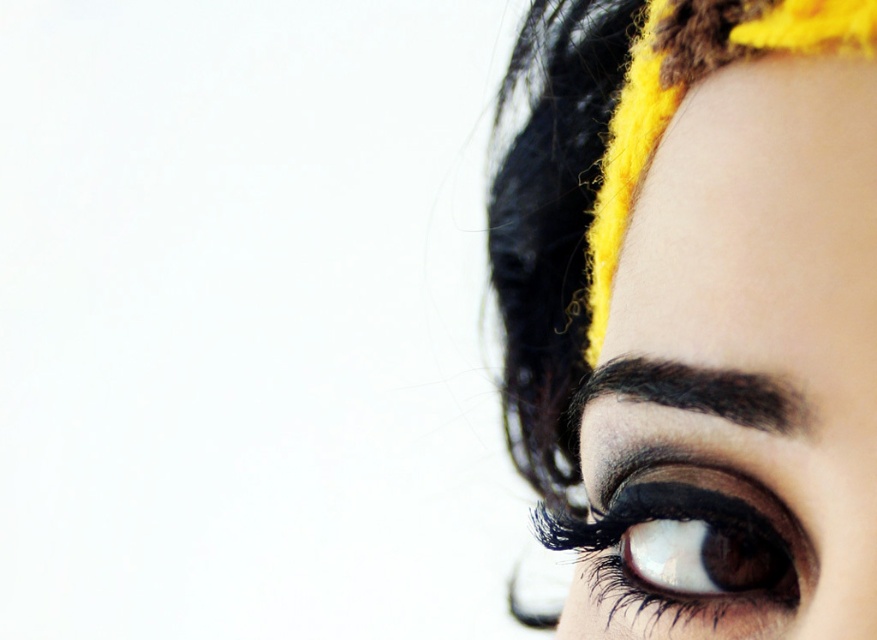
Question: Considering the real-world distances, which object is closest to the matte black eye at upper right?

Choices:
 (A) dark brown hair at upper right
 (B) shiny brown eye at center

Answer: (B)

Question: Can you confirm if shiny brown eye at center is positioned to the left of dark brown hair at upper right?

Choices:
 (A) no
 (B) yes

Answer: (A)

Question: Does matte black eye at upper right appear over shiny brown eye at center?

Choices:
 (A) no
 (B) yes

Answer: (B)

Question: Does matte black eye at upper right appear on the right side of dark brown hair at upper right?

Choices:
 (A) yes
 (B) no

Answer: (A)

Question: Which point is farther from the camera taking this photo?

Choices:
 (A) (631, 378)
 (B) (818, 4)
 (C) (661, 570)

Answer: (C)

Question: Which point appears closest to the camera in this image?

Choices:
 (A) pos(744,547)
 (B) pos(747,256)
 (C) pos(697,396)

Answer: (B)